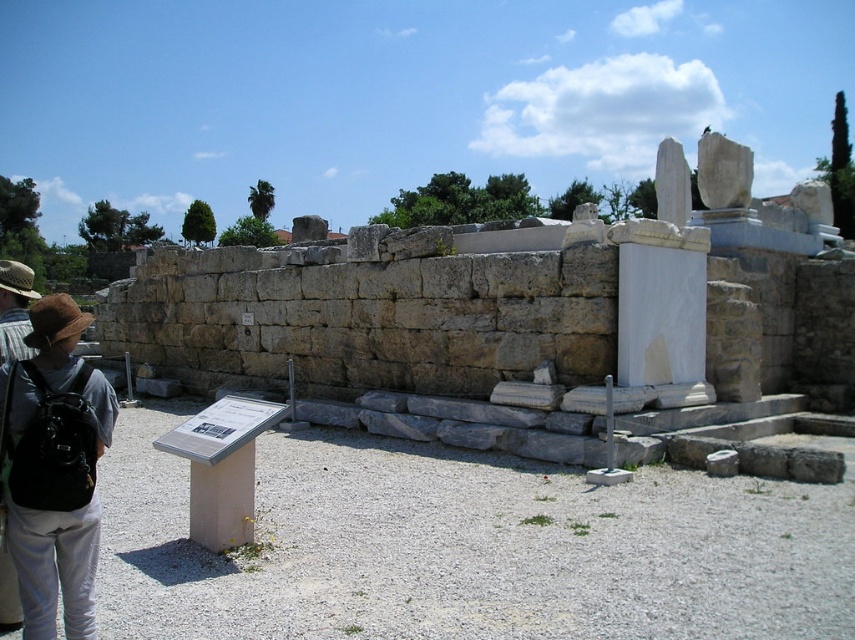
Question: Which point is farther from the camera taking this photo?

Choices:
 (A) (15, 492)
 (B) (537, 424)

Answer: (B)

Question: Does stone wall at center appear on the right side of brown fabric backpack at lower left?

Choices:
 (A) no
 (B) yes

Answer: (B)

Question: Considering the relative positions of stone wall at center and brown fabric backpack at lower left in the image provided, where is stone wall at center located with respect to brown fabric backpack at lower left?

Choices:
 (A) above
 (B) below

Answer: (A)

Question: Observing the image, what is the correct spatial positioning of stone wall at center in reference to brown fabric backpack at lower left?

Choices:
 (A) below
 (B) above

Answer: (B)